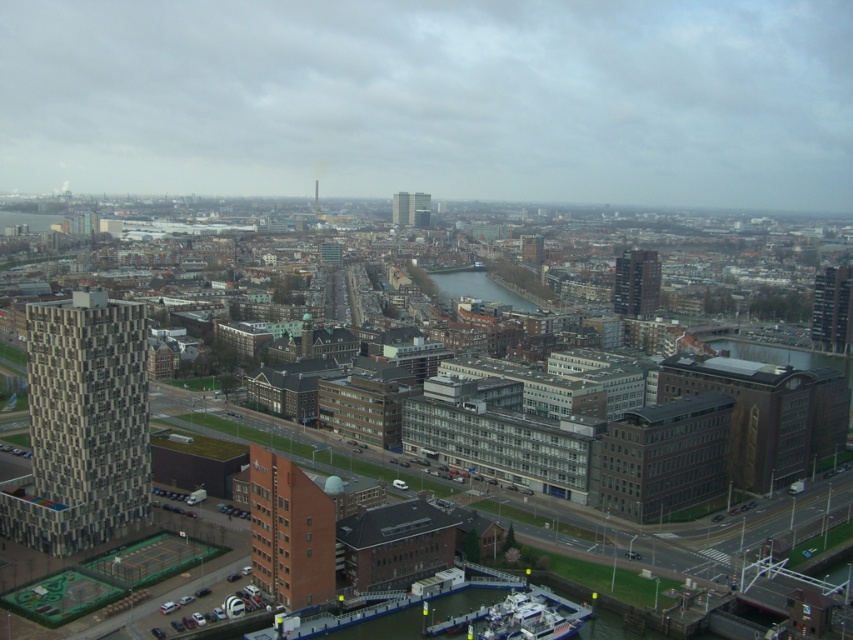
You are a drone operator trying to locate a specific building in this cityscape. You have coordinates pointing to point [82,426]. Based on the scene description, which building does this coordinate correspond to?

The point [82,426] corresponds to the textured gray building at left.